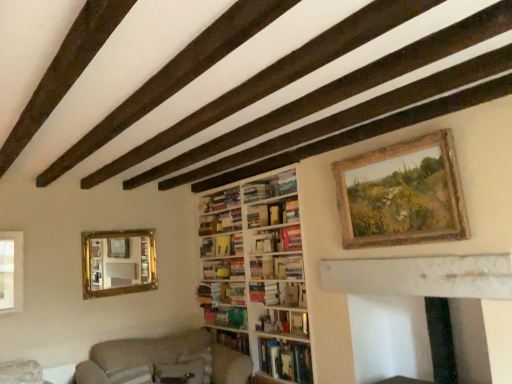
Find the location of a particular element. This screenshot has width=512, height=384. free spot above hardcover book at center, which is the fourth book from bottom to top (from a real-world perspective) is located at coordinates (258, 283).